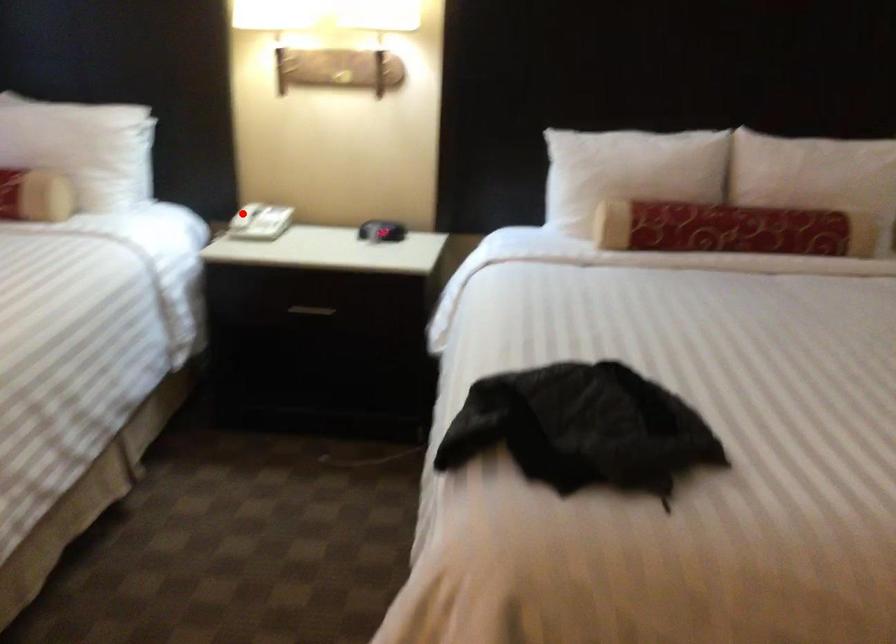
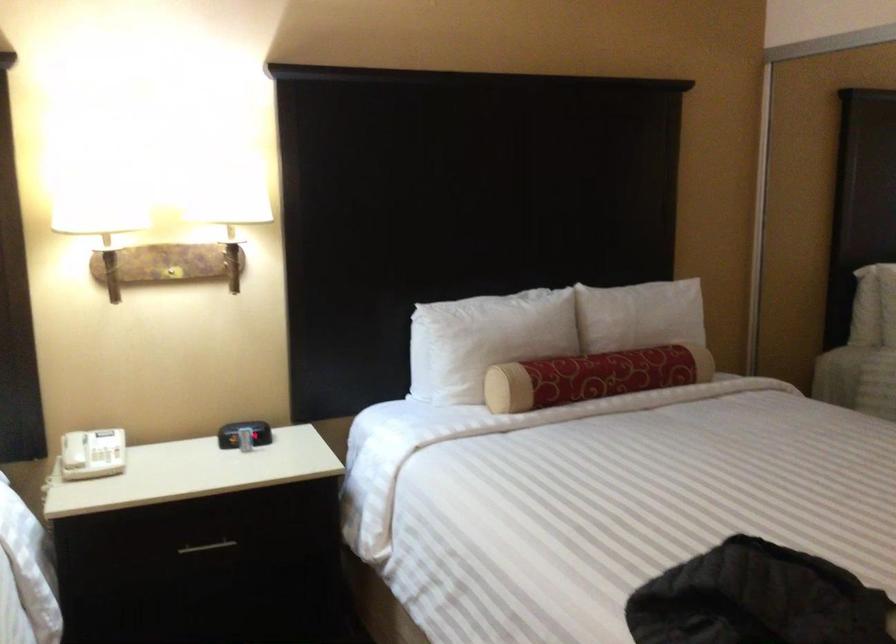
Question: I am providing you with two images of the same scene from different viewpoints. In image1, a red point is highlighted. Considering the same 3D point in image2, which of the following is correct?

Choices:
 (A) It is closer
 (B) It is farther

Answer: (A)